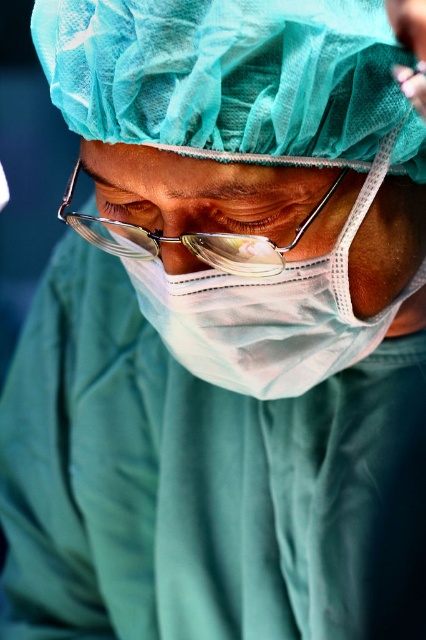
You are a medical supply inspector checking the protective gear of a healthcare worker. You notice the white matte mask at center and the metallic wire frame glasses at center. Which object has a larger vertical dimension?

The white matte mask at center has a greater height compared to the metallic wire frame glasses at center, so the white matte mask at center has a larger vertical dimension.

You are a medical student observing a surgeon in the operating room. You notice the white matte mask at center and the metallic wire frame glasses at center. Which object is positioned more to the left?

The metallic wire frame glasses at center are positioned more to the left than the white matte mask at center.